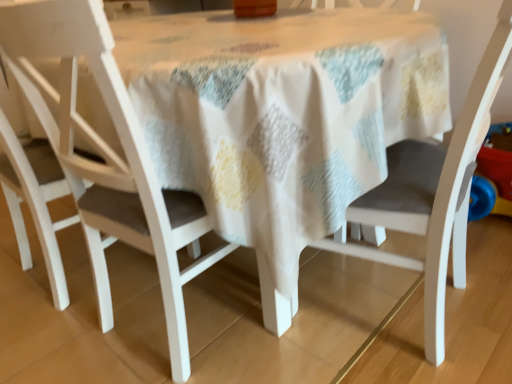
Question: Can we say matte white chair at center, the second chair in the left-to-right sequence, lies outside white matte chair at center, which is the 3th chair from left to right?

Choices:
 (A) yes
 (B) no

Answer: (A)

Question: Considering the relative sizes of matte white chair at center, the 2th chair in the right-to-left sequence, and white matte chair at center, which is the 3th chair from left to right, in the image provided, is matte white chair at center, the 2th chair in the right-to-left sequence, smaller than white matte chair at center, which is the 3th chair from left to right,?

Choices:
 (A) no
 (B) yes

Answer: (B)

Question: Are matte white chair at center, the second chair in the left-to-right sequence, and white matte chair at center, which is the 3th chair from left to right, beside each other?

Choices:
 (A) yes
 (B) no

Answer: (B)

Question: Does matte white chair at center, the 2th chair in the right-to-left sequence, have a greater width compared to white matte chair at center, which is the 3th chair from left to right?

Choices:
 (A) no
 (B) yes

Answer: (A)

Question: Is white matte chair at center, which is the 3th chair from left to right, inside matte white chair at center, the 2th chair in the right-to-left sequence?

Choices:
 (A) no
 (B) yes

Answer: (A)

Question: Is matte white chair at center, the 2th chair in the right-to-left sequence, turned away from white matte chair at center, which is the 3th chair from left to right?

Choices:
 (A) no
 (B) yes

Answer: (A)

Question: Can you confirm if matte white chair at center, the 2th chair in the right-to-left sequence, is smaller than white matte chair at left, positioned as the first chair in left-to-right order?

Choices:
 (A) yes
 (B) no

Answer: (B)

Question: Does matte white chair at center, the second chair in the left-to-right sequence, touch white matte chair at left, arranged as the third chair when viewed from the right?

Choices:
 (A) no
 (B) yes

Answer: (A)

Question: From a real-world perspective, is matte white chair at center, the second chair in the left-to-right sequence, over white matte chair at left, arranged as the third chair when viewed from the right?

Choices:
 (A) no
 (B) yes

Answer: (A)

Question: From a real-world perspective, is matte white chair at center, the second chair in the left-to-right sequence, beneath white matte chair at left, positioned as the first chair in left-to-right order?

Choices:
 (A) no
 (B) yes

Answer: (B)

Question: From the image's perspective, is matte white chair at center, the 2th chair in the right-to-left sequence, under white matte chair at left, positioned as the first chair in left-to-right order?

Choices:
 (A) no
 (B) yes

Answer: (B)

Question: Is matte white chair at center, the 2th chair in the right-to-left sequence, positioned with its back to white matte chair at left, positioned as the first chair in left-to-right order?

Choices:
 (A) no
 (B) yes

Answer: (A)

Question: Can you confirm if white matte chair at left, positioned as the first chair in left-to-right order, is shorter than matte white chair at center, the 2th chair in the right-to-left sequence?

Choices:
 (A) yes
 (B) no

Answer: (A)